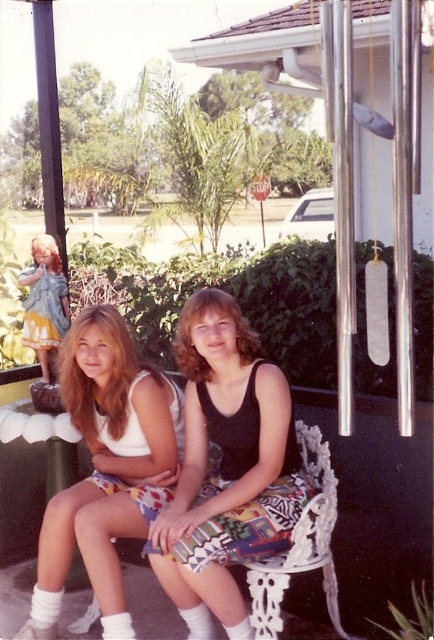
Question: Which point is closer to the camera?

Choices:
 (A) (193, 474)
 (B) (69, 529)
 (C) (36, 256)

Answer: (B)

Question: Which of these objects is positioned closest to the matte yellow dress at left?

Choices:
 (A) black matte tank top at center
 (B) white fabric tank top at left

Answer: (B)

Question: Is black matte tank top at center wider than white fabric tank top at left?

Choices:
 (A) no
 (B) yes

Answer: (A)

Question: Is white fabric tank top at left to the right of matte yellow dress at left from the viewer's perspective?

Choices:
 (A) no
 (B) yes

Answer: (B)

Question: Does black matte tank top at center have a smaller size compared to white fabric tank top at left?

Choices:
 (A) yes
 (B) no

Answer: (A)

Question: Which of these objects is positioned closest to the black matte tank top at center?

Choices:
 (A) white fabric tank top at left
 (B) matte yellow dress at left

Answer: (A)